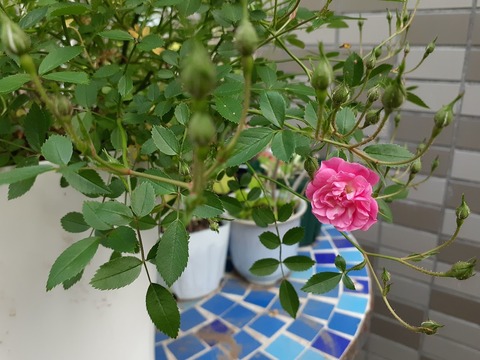
This screenshot has height=360, width=480. What are the coordinates of `mosaic table` in the screenshot? It's located at (259, 323).